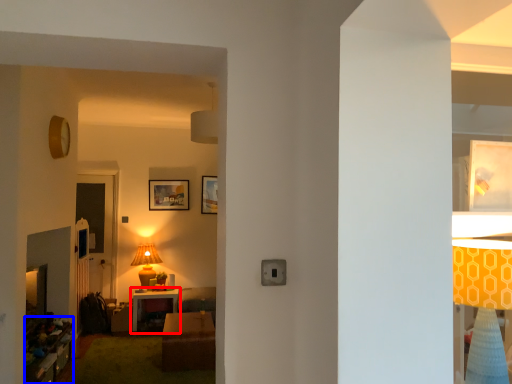
Question: Which object is further to the camera taking this photo, table (highlighted by a red box) or dresser (highlighted by a blue box)?

Choices:
 (A) table
 (B) dresser

Answer: (A)